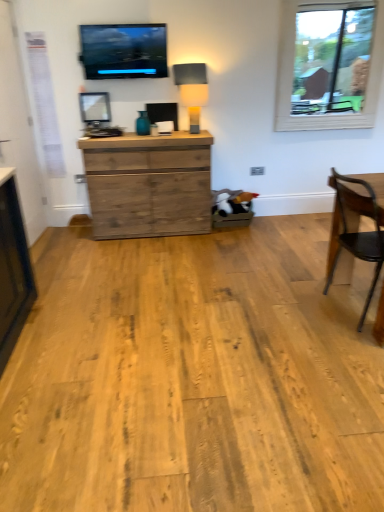
Where is `empty space that is ontop of matte beige lampshade at center (from a real-world perspective)`? This screenshot has width=384, height=512. empty space that is ontop of matte beige lampshade at center (from a real-world perspective) is located at coordinates (189, 82).